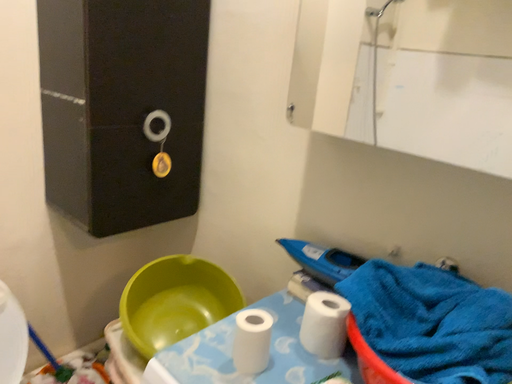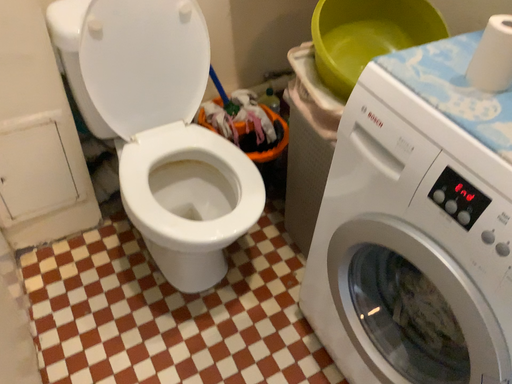
Question: Which way did the camera rotate in the video?

Choices:
 (A) rotated right
 (B) rotated left

Answer: (B)